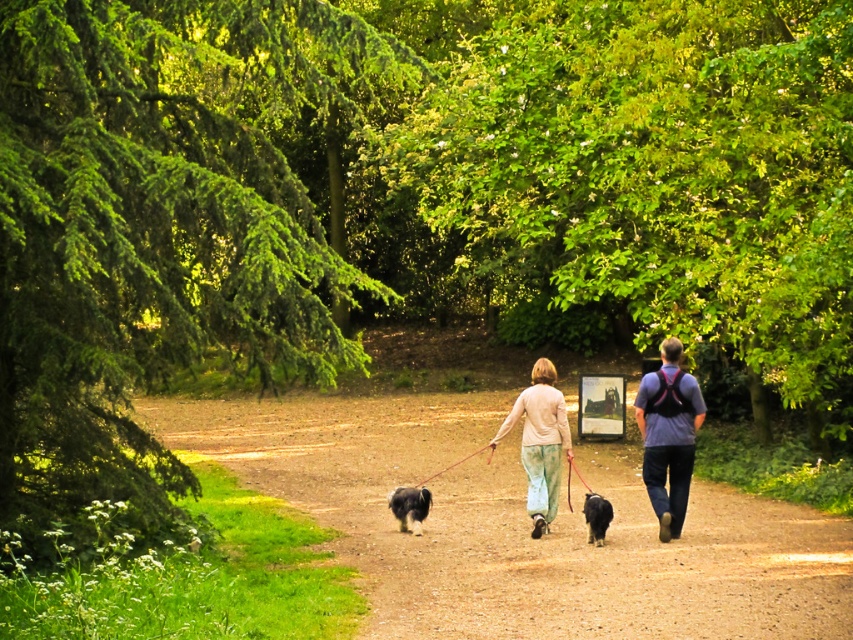
You are a photographer standing at the edge of the gravel path. You want to take a photo that includes both the matte blue shirt at center and the soft black fur at center. Which object should you adjust your camera to focus on first if you want to ensure both are in the frame?

The matte blue shirt at center is positioned on the right side of soft black fur at center. To include both in the frame, focus on the soft black fur at center first as it is on the left, then adjust the camera to include the matte blue shirt at center on the right.

You are a hiker who wants to stay dry during a sudden rain shower. You see the dirt path at center and the blue denim jeans at center. Which surface should you avoid stepping on to keep your shoes from getting muddy?

The dirt path at center is located below blue denim jeans at center, so you should avoid stepping on the dirt path at center to keep your shoes from getting muddy.